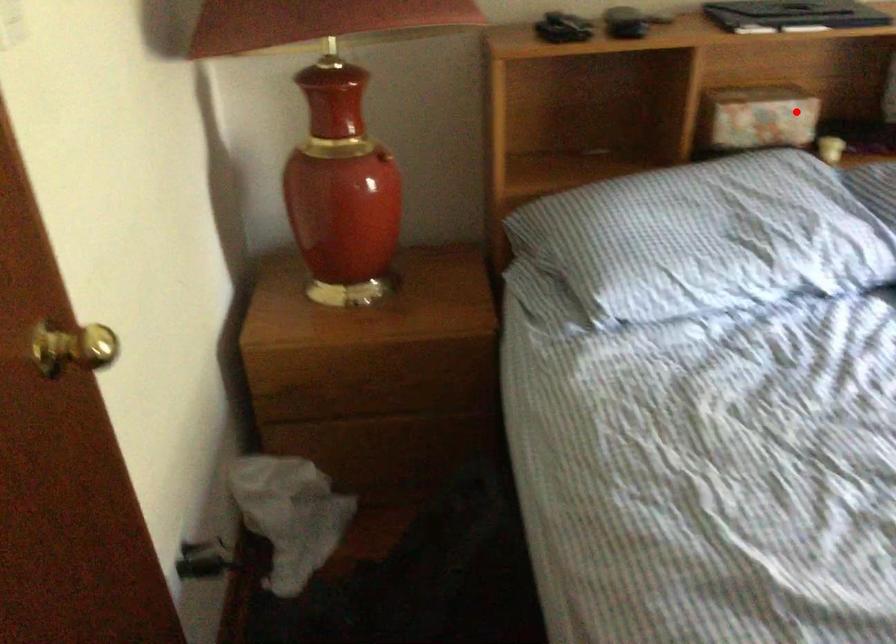
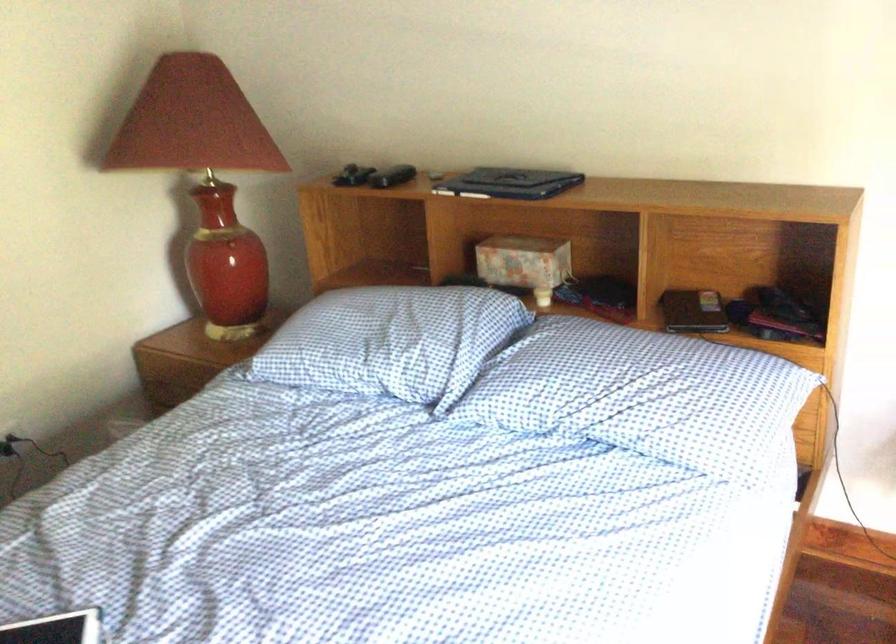
Find the pixel in the second image that matches the highlighted location in the first image.

(524, 263)